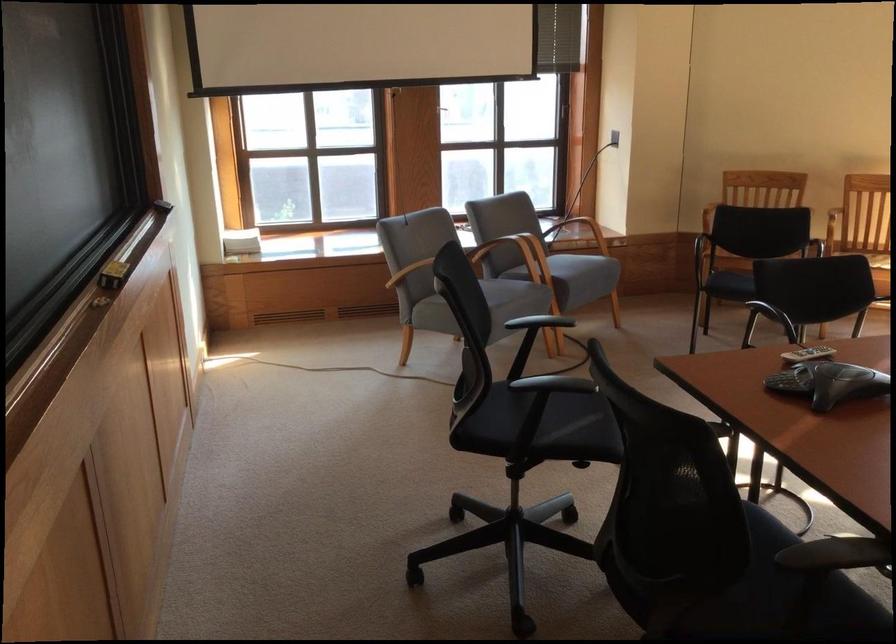
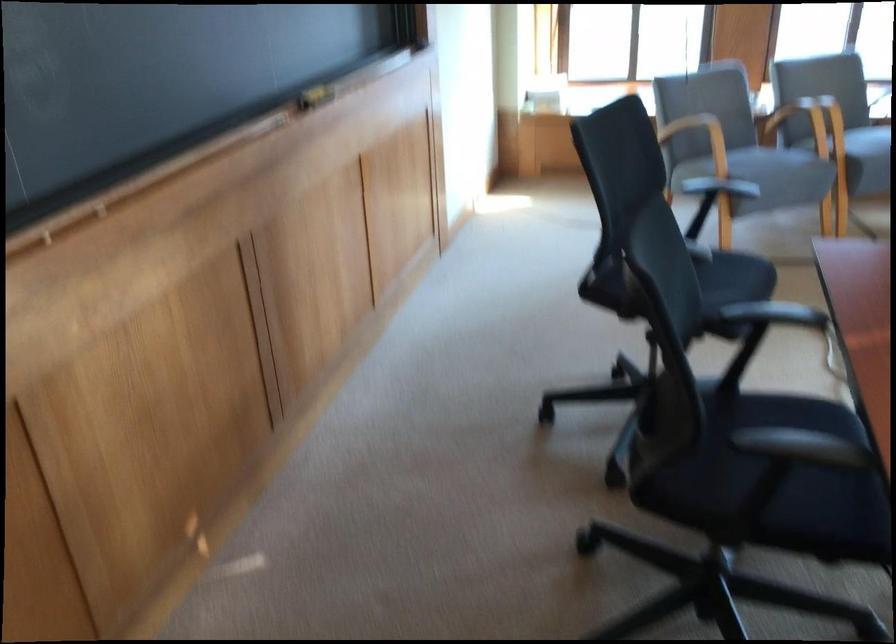
Find the pixel in the second image that matches [565,277] in the first image.

(859, 152)